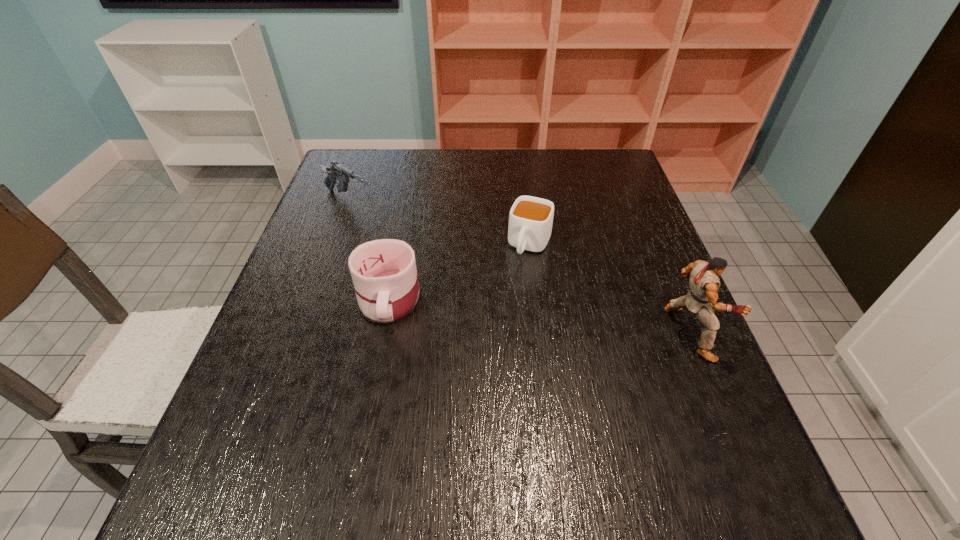
Where is `vacant point at the left edge`? vacant point at the left edge is located at coordinates (332, 300).

Locate an element on the screen. Image resolution: width=960 pixels, height=540 pixels. vacant space at the right edge is located at coordinates (690, 381).

In the image, there is a desktop. At what (x,y) coordinates should I click in order to perform the action: click on vacant space at the far right corner. Please return your answer as a coordinate pair (x, y). The height and width of the screenshot is (540, 960). Looking at the image, I should click on (579, 178).

I want to click on free spot between the cup and the tallest object, so click(610, 289).

Where is `vacant area that lies between the mug and the tallest object`? The width and height of the screenshot is (960, 540). vacant area that lies between the mug and the tallest object is located at coordinates (539, 316).

You are a GUI agent. You are given a task and a screenshot of the screen. Output one action in this format:
    pyautogui.click(x=<x>, y=<y>)
    Task: Click on the vacant space that's between the cup and the puncher
    This screenshot has width=960, height=540.
    Given the screenshot: What is the action you would take?
    pyautogui.click(x=610, y=289)

Locate an element on the screen. The image size is (960, 540). empty location between the tallest object and the third object from left to right is located at coordinates (610, 289).

Locate an element on the screen. Image resolution: width=960 pixels, height=540 pixels. free area in between the tallest object and the second object from left to right is located at coordinates (539, 316).

This screenshot has height=540, width=960. Find the location of `unoccupied area between the leftmost object and the rightmost object`. unoccupied area between the leftmost object and the rightmost object is located at coordinates pyautogui.click(x=519, y=268).

This screenshot has height=540, width=960. Identify the location of free spot between the puncher and the third object from left to right. (610, 289).